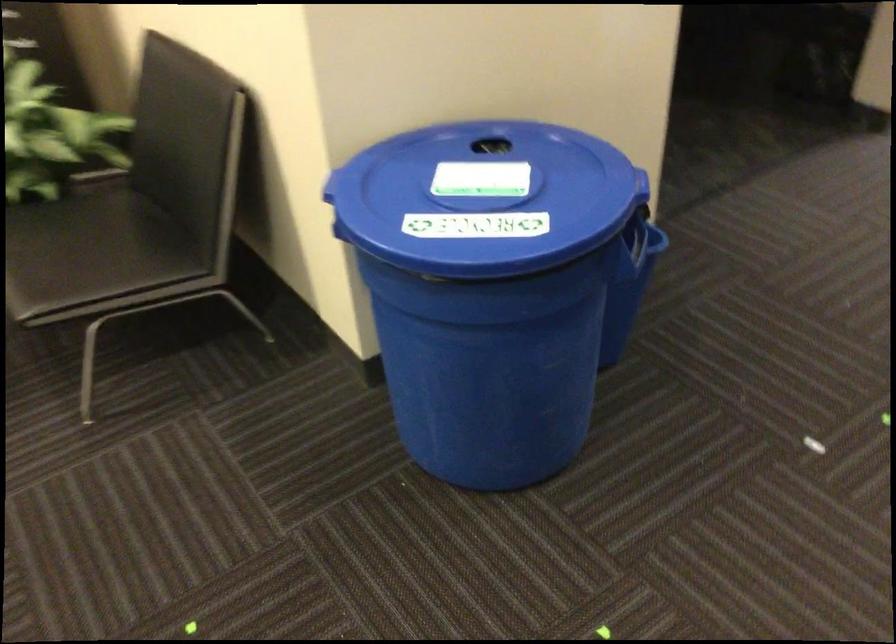
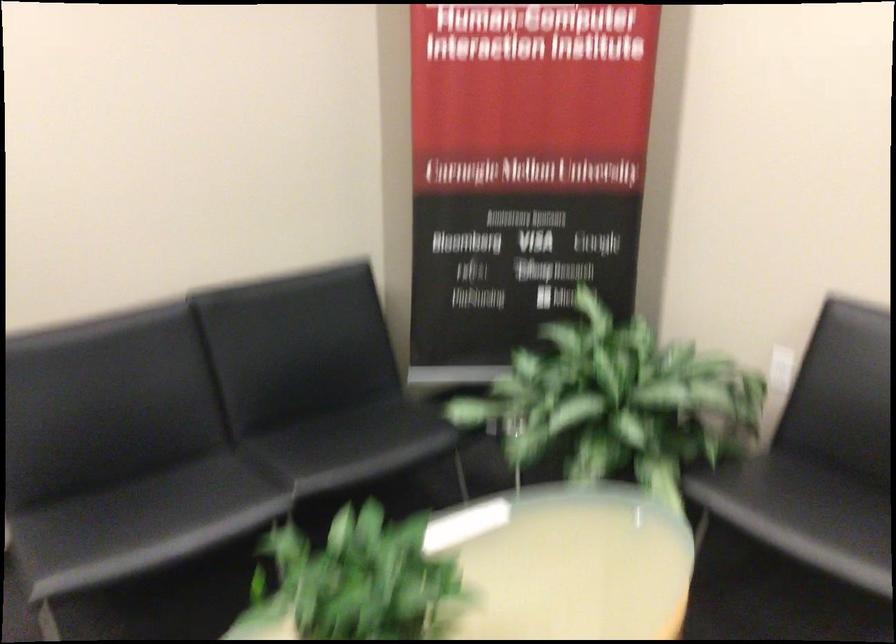
Question: What movement of the cameraman would produce the second image?

Choices:
 (A) Left
 (B) Right
 (C) Forward
 (D) Backward

Answer: (A)